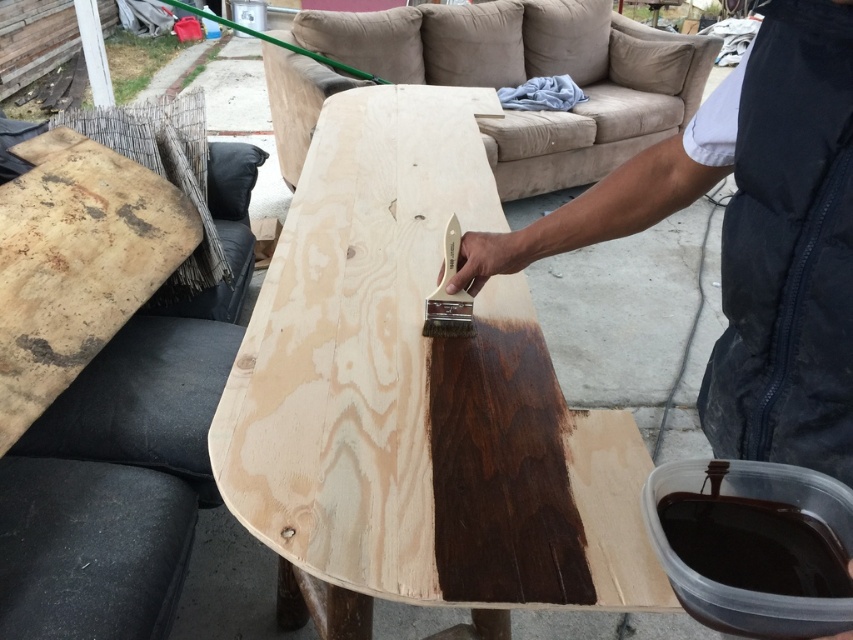
Question: Is stained wood table at center below dark brown wood plank at upper left?

Choices:
 (A) yes
 (B) no

Answer: (B)

Question: Is stained wood table at center positioned at the back of dark brown wood plank at upper left?

Choices:
 (A) yes
 (B) no

Answer: (B)

Question: Which is nearer to the dark brown wood plank at center?

Choices:
 (A) dark brown wood plank at upper left
 (B) stained wood table at center

Answer: (B)

Question: Which of the following is the closest to the observer?

Choices:
 (A) (126, 228)
 (B) (421, 164)
 (C) (799, 241)

Answer: (C)

Question: From the image, what is the correct spatial relationship of stained wood table at center in relation to dark brown wood plank at upper left?

Choices:
 (A) above
 (B) below

Answer: (A)

Question: Which of these objects is positioned closest to the dark brown wood plank at upper left?

Choices:
 (A) stained wood table at center
 (B) dark brown wood plank at center

Answer: (A)